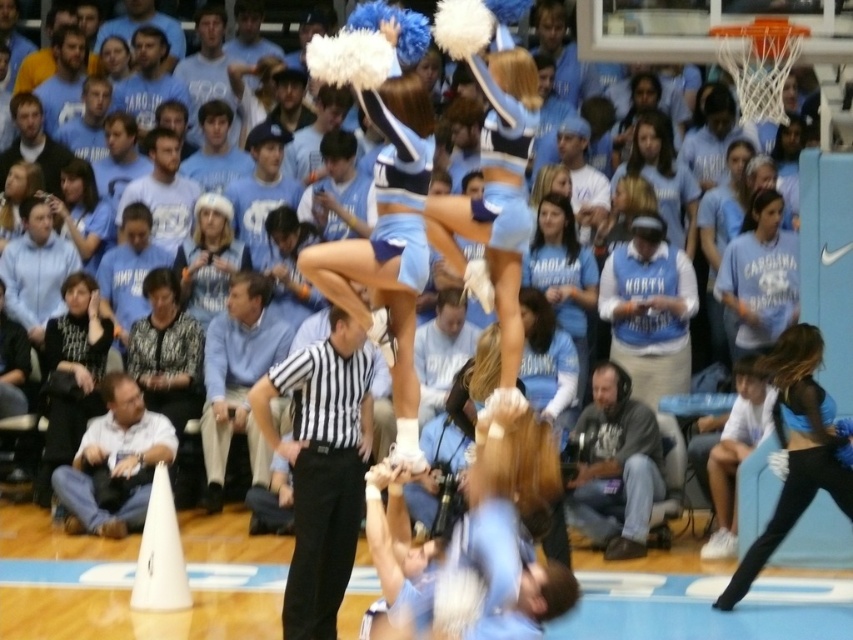
Question: Can you confirm if black matte cheerleader at right is positioned to the right of light blue fabric at center?

Choices:
 (A) yes
 (B) no

Answer: (A)

Question: Is the position of light blue fabric cheerleader at center more distant than that of black textured blouse at left?

Choices:
 (A) no
 (B) yes

Answer: (A)

Question: Is light blue fabric cheerleader at center closer to camera compared to white fuzzy hat at upper center?

Choices:
 (A) yes
 (B) no

Answer: (A)

Question: Among these objects, which one is nearest to the camera?

Choices:
 (A) black striped shirt at center
 (B) black matte cheerleader at right
 (C) black textured blouse at left

Answer: (A)

Question: Which point is farther to the camera?

Choices:
 (A) (671, 138)
 (B) (554, 221)
 (C) (25, 172)
 (D) (796, 449)

Answer: (C)

Question: Which is farther from the black striped shirt at center?

Choices:
 (A) black matte cheerleader at right
 (B) light blue jersey at center
 (C) black textured blouse at left
 (D) light blue fabric at center

Answer: (D)